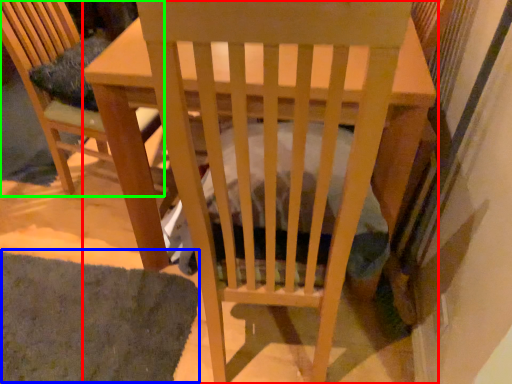
Question: Based on their relative distances, which object is farther from table (highlighted by a red box)? Choose from mat (highlighted by a blue box) and chair (highlighted by a green box).

Choices:
 (A) mat
 (B) chair

Answer: (B)